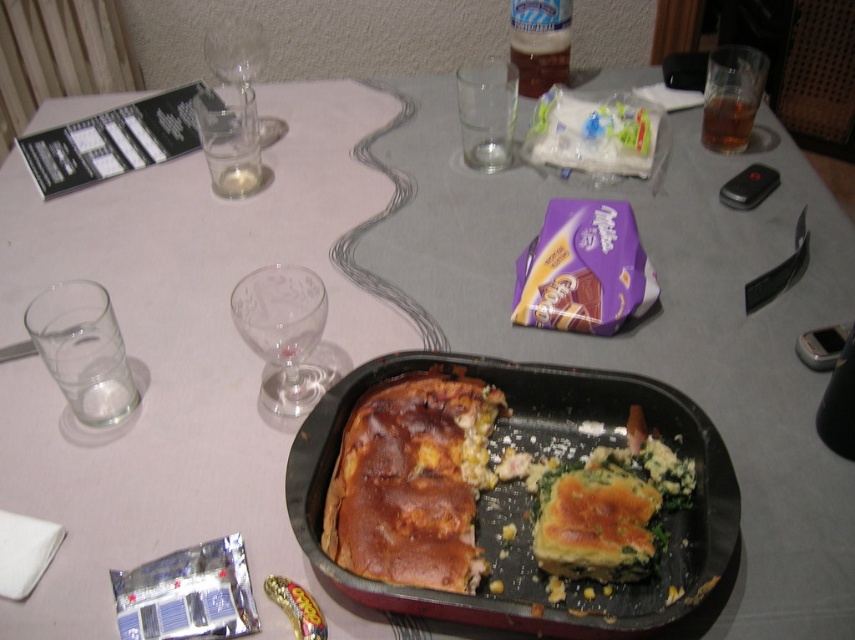
You are a guest at this table and want to reach for the golden brown crusty bread at center without knocking over the transparent glass wine glass at upper left. Based on their positions, which item is closer to you?

The golden brown crusty bread at center is below the transparent glass wine glass at upper left, so it is closer to you. You should reach for it carefully to avoid disturbing the glass.

You are a guest at the table and want to reach for the golden brown crusty bread at center. Which direction should you move your hand from the tray to the bread?

The golden brown crusty bread at center is located at point (411,483), so you should move your hand to the right from the tray to reach it.

You are a guest at a dinner party and see the golden brown flaky pastry at center and the clear glass wine glass at center on the table. Which item is positioned lower relative to the other?

The golden brown flaky pastry at center is positioned below the clear glass wine glass at center, so it is lower.